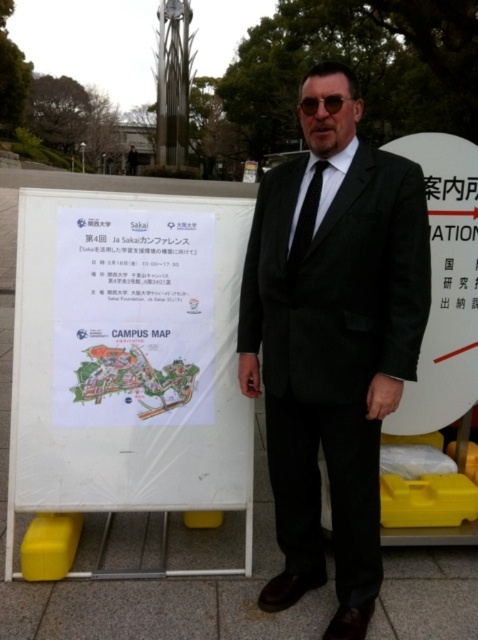
Can you confirm if white plastic signboard at center is positioned to the left of black silk tie at center?

Indeed, white plastic signboard at center is positioned on the left side of black silk tie at center.

Is white plastic signboard at center shorter than black silk tie at center?

No.

Between point (139, 314) and point (292, 246), which one is positioned behind?

Positioned behind is point (139, 314).

The image size is (478, 640). What are the coordinates of `white plastic signboard at center` in the screenshot? It's located at (128, 368).

Is white plastic sign at right shorter than black silk tie at center?

In fact, white plastic sign at right may be taller than black silk tie at center.

Which of these two, white plastic sign at right or black silk tie at center, stands shorter?

With less height is black silk tie at center.

What are the coordinates of `white plastic sign at right` in the screenshot? It's located at (445, 285).

Is white paper poster at center wider than black silk tie at center?

Yes.

Is point (192, 305) positioned in front of point (308, 182)?

No.

What do you see at coordinates (132, 317) in the screenshot? This screenshot has height=640, width=478. I see `white paper poster at center` at bounding box center [132, 317].

I want to click on white paper poster at center, so click(x=132, y=317).